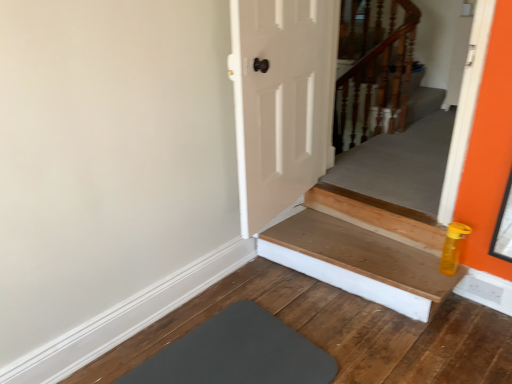
Question: Considering the relative sizes of wooden at bottom and gray rubber mat at lower left in the image provided, is wooden at bottom shorter than gray rubber mat at lower left?

Choices:
 (A) no
 (B) yes

Answer: (A)

Question: Is wooden at bottom looking in the opposite direction of gray rubber mat at lower left?

Choices:
 (A) no
 (B) yes

Answer: (A)

Question: From a real-world perspective, does wooden at bottom sit lower than gray rubber mat at lower left?

Choices:
 (A) yes
 (B) no

Answer: (B)

Question: Is wooden at bottom positioned beyond the bounds of gray rubber mat at lower left?

Choices:
 (A) no
 (B) yes

Answer: (B)

Question: Considering the relative positions of wooden at bottom and gray rubber mat at lower left in the image provided, is wooden at bottom to the right of gray rubber mat at lower left from the viewer's perspective?

Choices:
 (A) yes
 (B) no

Answer: (A)

Question: From a real-world perspective, relative to wooden at upper right, is gray rubber mat at lower left vertically above or below?

Choices:
 (A) below
 (B) above

Answer: (A)

Question: Considering the positions of point (215, 364) and point (366, 74), is point (215, 364) closer or farther from the camera than point (366, 74)?

Choices:
 (A) closer
 (B) farther

Answer: (A)

Question: Based on their positions, is gray rubber mat at lower left located to the left or right of wooden at upper right?

Choices:
 (A) left
 (B) right

Answer: (A)

Question: From their relative heights in the image, would you say gray rubber mat at lower left is taller or shorter than wooden at upper right?

Choices:
 (A) short
 (B) tall

Answer: (A)

Question: From a real-world perspective, is wooden at bottom positioned above or below wooden at upper right?

Choices:
 (A) above
 (B) below

Answer: (B)

Question: Does point (369, 294) appear closer or farther from the camera than point (388, 21)?

Choices:
 (A) farther
 (B) closer

Answer: (B)

Question: From the image's perspective, relative to wooden at upper right, is wooden at bottom above or below?

Choices:
 (A) above
 (B) below

Answer: (B)

Question: Based on their positions, is wooden at bottom located to the left or right of wooden at upper right?

Choices:
 (A) left
 (B) right

Answer: (A)

Question: Does point (414, 8) appear closer or farther from the camera than point (232, 364)?

Choices:
 (A) farther
 (B) closer

Answer: (A)

Question: From the image's perspective, relative to gray rubber mat at lower left, is wooden at upper right above or below?

Choices:
 (A) below
 (B) above

Answer: (B)